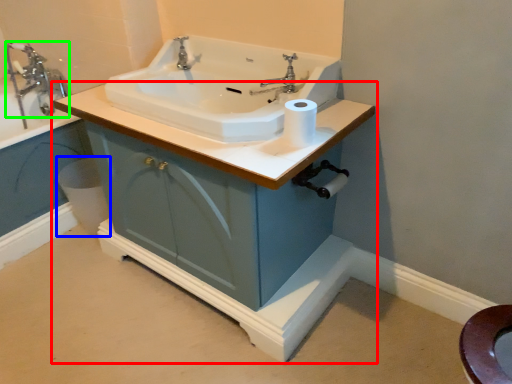
Question: Estimate the real-world distances between objects in this image. Which object is closer to bathroom cabinet (highlighted by a red box), bidet (highlighted by a blue box) or tap (highlighted by a green box)?

Choices:
 (A) bidet
 (B) tap

Answer: (A)